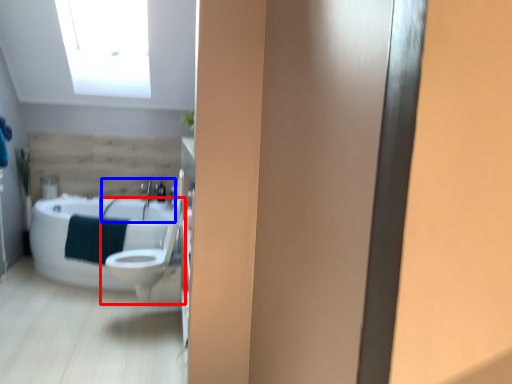
Question: Which of the following is the closest to the observer, toilet (highlighted by a red box) or sink (highlighted by a blue box)?

Choices:
 (A) toilet
 (B) sink

Answer: (A)